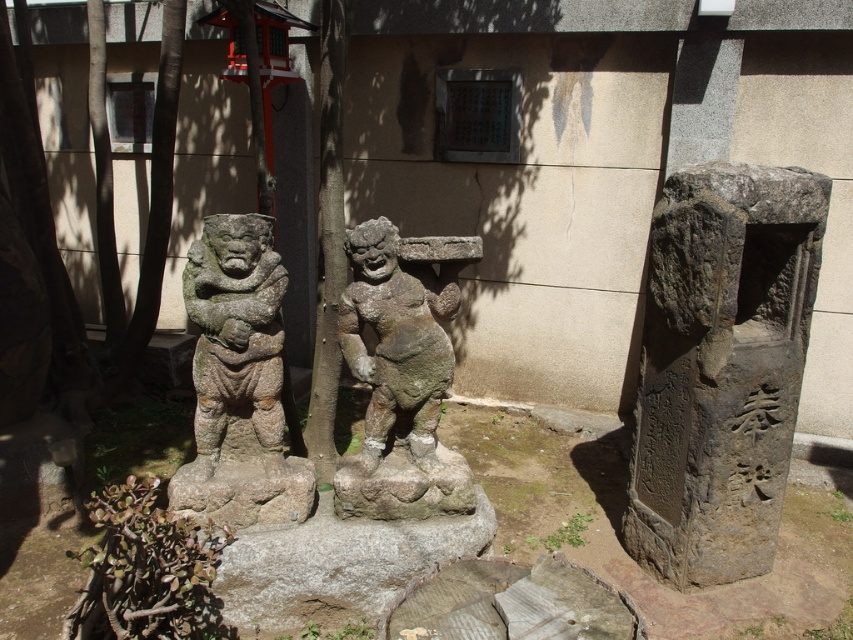
Question: Can you confirm if gray stone statue at center is positioned below granite statue at left?

Choices:
 (A) yes
 (B) no

Answer: (A)

Question: Which object appears farthest from the camera in this image?

Choices:
 (A) granite statue at left
 (B) gray stone statue at center

Answer: (B)

Question: Which of the following is the closest to the observer?

Choices:
 (A) gray stone pillar at right
 (B) granite statue at left
 (C) gray stone statue at center

Answer: (A)

Question: Can you confirm if gray stone pillar at right is positioned to the right of gray stone statue at center?

Choices:
 (A) no
 (B) yes

Answer: (B)

Question: Which of the following is the farthest from the observer?

Choices:
 (A) granite statue at left
 (B) gray stone pillar at right
 (C) gray stone statue at center

Answer: (C)

Question: Does gray stone pillar at right have a larger size compared to gray stone statue at center?

Choices:
 (A) no
 (B) yes

Answer: (B)